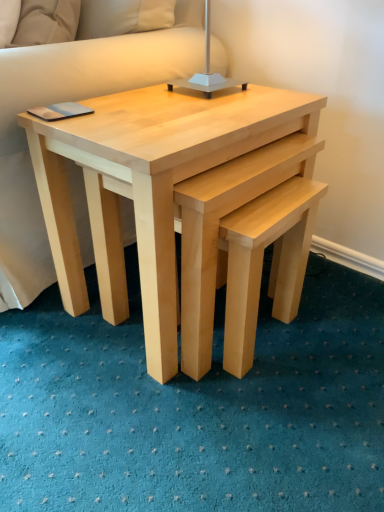
Find the location of a particular element. natural wood nesting tables at center is located at coordinates (147, 186).

Describe the element at coordinates (147, 186) in the screenshot. I see `natural wood nesting tables at center` at that location.

The height and width of the screenshot is (512, 384). Describe the element at coordinates (207, 70) in the screenshot. I see `metallic silver table lamp at upper center` at that location.

The width and height of the screenshot is (384, 512). Identify the location of metallic silver table lamp at upper center. (207, 70).

Where is `natural wood nesting tables at center`? The image size is (384, 512). natural wood nesting tables at center is located at coordinates tap(147, 186).

Would you say natural wood nesting tables at center is to the left or to the right of metallic silver table lamp at upper center in the picture?

Based on their positions, natural wood nesting tables at center is located to the left of metallic silver table lamp at upper center.

Is the position of natural wood nesting tables at center more distant than that of metallic silver table lamp at upper center?

No, natural wood nesting tables at center is closer to the camera.

Is point (61, 277) closer or farther from the camera than point (208, 45)?

Point (61, 277).

From the picture: From the image's perspective, which is above, natural wood nesting tables at center or metallic silver table lamp at upper center?

From the image's view, metallic silver table lamp at upper center is above.

From a real-world perspective, is natural wood nesting tables at center over metallic silver table lamp at upper center?

No.

Considering the relative sizes of natural wood nesting tables at center and metallic silver table lamp at upper center in the image provided, is natural wood nesting tables at center wider than metallic silver table lamp at upper center?

Indeed, natural wood nesting tables at center has a greater width compared to metallic silver table lamp at upper center.

From their relative heights in the image, would you say natural wood nesting tables at center is taller or shorter than metallic silver table lamp at upper center?

In the image, natural wood nesting tables at center appears to be taller than metallic silver table lamp at upper center.

Does natural wood nesting tables at center have a larger size compared to metallic silver table lamp at upper center?

Indeed, natural wood nesting tables at center has a larger size compared to metallic silver table lamp at upper center.

Is natural wood nesting tables at center outside of metallic silver table lamp at upper center?

Yes, natural wood nesting tables at center is located beyond the bounds of metallic silver table lamp at upper center.

Is natural wood nesting tables at center next to metallic silver table lamp at upper center and touching it?

No, natural wood nesting tables at center is not next to metallic silver table lamp at upper center.

Could you tell me if natural wood nesting tables at center is facing metallic silver table lamp at upper center?

No, natural wood nesting tables at center is not turned towards metallic silver table lamp at upper center.

How different are the orientations of natural wood nesting tables at center and metallic silver table lamp at upper center in degrees?

9.9e-05 degrees separate the facing orientations of natural wood nesting tables at center and metallic silver table lamp at upper center.

You are a GUI agent. You are given a task and a screenshot of the screen. Output one action in this format:
    pyautogui.click(x=<x>, y=<y>)
    Task: Click on the table lamp on the right of natural wood nesting tables at center
    
    Given the screenshot: What is the action you would take?
    pyautogui.click(x=207, y=70)

In the scene shown: Is metallic silver table lamp at upper center to the left of natural wood nesting tables at center from the viewer's perspective?

In fact, metallic silver table lamp at upper center is to the right of natural wood nesting tables at center.

Based on the photo, considering the relative positions of metallic silver table lamp at upper center and natural wood nesting tables at center in the image provided, is metallic silver table lamp at upper center in front of natural wood nesting tables at center?

No, metallic silver table lamp at upper center is behind natural wood nesting tables at center.

Is point (209, 54) closer or farther from the camera than point (161, 154)?

Point (209, 54) appears to be farther away from the viewer than point (161, 154).

From the image's perspective, is metallic silver table lamp at upper center under natural wood nesting tables at center?

No.

From a real-world perspective, who is located lower, metallic silver table lamp at upper center or natural wood nesting tables at center?

natural wood nesting tables at center, from a real-world perspective.

Based on the photo, which object is wider, metallic silver table lamp at upper center or natural wood nesting tables at center?

natural wood nesting tables at center.

Which of these two, metallic silver table lamp at upper center or natural wood nesting tables at center, stands taller?

natural wood nesting tables at center.

Which of these two, metallic silver table lamp at upper center or natural wood nesting tables at center, is bigger?

Bigger between the two is natural wood nesting tables at center.

Can natural wood nesting tables at center be found inside metallic silver table lamp at upper center?

No, natural wood nesting tables at center is located outside of metallic silver table lamp at upper center.

Is the surface of metallic silver table lamp at upper center in direct contact with natural wood nesting tables at center?

metallic silver table lamp at upper center and natural wood nesting tables at center are clearly separated.

Is natural wood nesting tables at center at the back of metallic silver table lamp at upper center?

No, metallic silver table lamp at upper center is not facing away from natural wood nesting tables at center.

Locate an element on the screen. coffee table located in front of the metallic silver table lamp at upper center is located at coordinates (147, 186).

Locate an element on the screen. This screenshot has width=384, height=512. coffee table in front of the metallic silver table lamp at upper center is located at coordinates (147, 186).

At what (x,y) coordinates should I click in order to perform the action: click on table lamp that is behind the natural wood nesting tables at center. Please return your answer as a coordinate pair (x, y). Looking at the image, I should click on (207, 70).